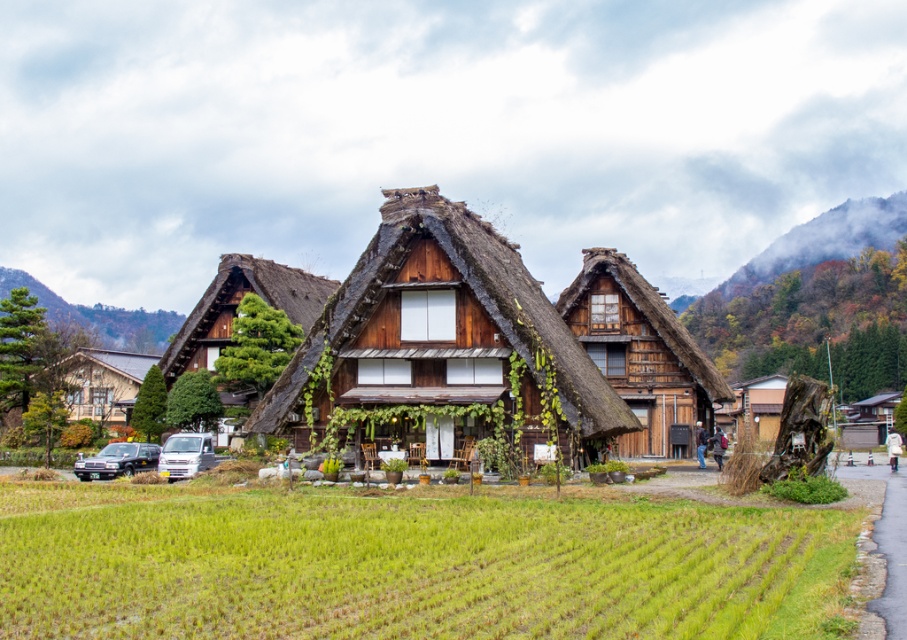
Question: Which of the following is the closest to the observer?

Choices:
 (A) (527, 596)
 (B) (730, 296)
 (C) (111, 412)
 (D) (120, 472)

Answer: (A)

Question: Is thatched wood cottage at center below wooden house at center?

Choices:
 (A) yes
 (B) no

Answer: (A)

Question: Can you confirm if wooden thatched cottage at center is positioned to the right of wooden cottage at left?

Choices:
 (A) no
 (B) yes

Answer: (B)

Question: Which of the following is the farthest from the observer?

Choices:
 (A) white matte van at lower left
 (B) matte black suv at lower left
 (C) wooden house at center
 (D) thatched wood cottage at center

Answer: (C)

Question: Which point appears closest to the camera in this image?

Choices:
 (A) (174, 449)
 (B) (111, 461)
 (C) (694, 305)

Answer: (A)

Question: Is green grassy field at lower center wider than white matte van at lower left?

Choices:
 (A) yes
 (B) no

Answer: (A)